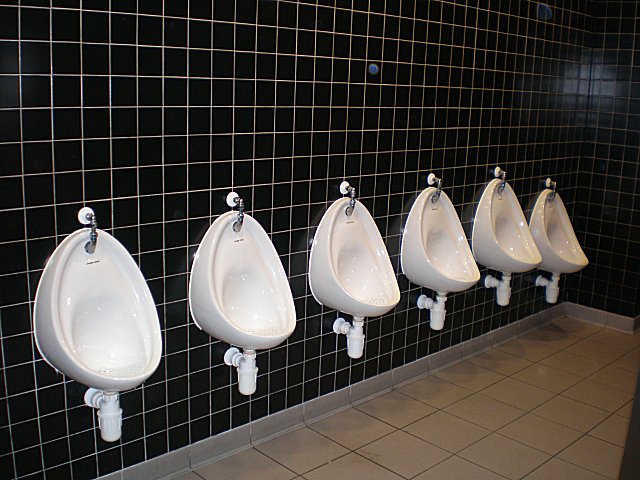
At what (x,y) coordinates should I click in order to perform the action: click on urinals. Please return your answer as a coordinate pair (x, y). Looking at the image, I should click on (81, 336), (258, 287), (347, 270), (429, 234), (491, 226), (561, 225).